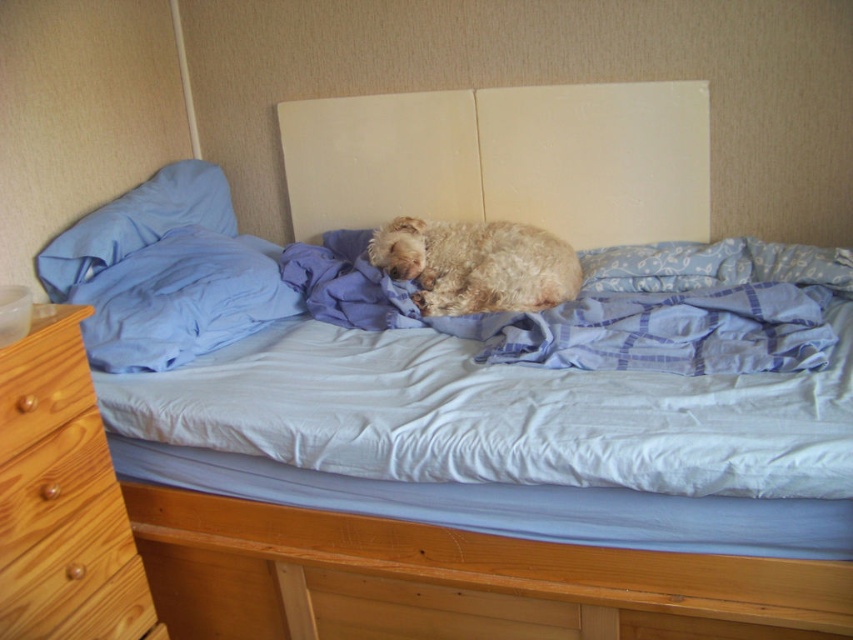
Question: Which point is farther from the camera taking this photo?

Choices:
 (A) (483, 230)
 (B) (254, 276)
 (C) (444, 321)

Answer: (A)

Question: Estimate the real-world distances between objects in this image. Which object is farther from the light brown wood dresser at lower left?

Choices:
 (A) white matte sheet at center
 (B) fuzzy beige dog at center
 (C) blue fabric pillow at left

Answer: (B)

Question: Is white matte sheet at center positioned behind light brown wood dresser at lower left?

Choices:
 (A) no
 (B) yes

Answer: (A)

Question: Is light brown wood dresser at lower left positioned before wooden drawer at lower left?

Choices:
 (A) yes
 (B) no

Answer: (B)

Question: Among these objects, which one is nearest to the camera?

Choices:
 (A) blue plaid fabric at center
 (B) fuzzy beige dog at center
 (C) light brown wood dresser at lower left
 (D) wooden drawer at lower left

Answer: (D)

Question: Does light brown wood dresser at lower left have a lesser width compared to blue fabric pillow at left?

Choices:
 (A) yes
 (B) no

Answer: (A)